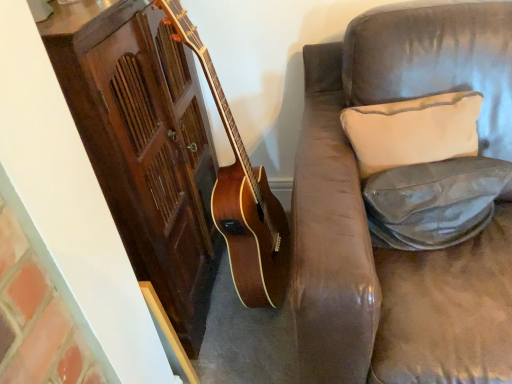
Describe the element at coordinates (435, 201) in the screenshot. I see `leather-like gray pillow at right, the 2th pillow from the top` at that location.

This screenshot has height=384, width=512. I want to click on leather-like gray pillow at right, the 2th pillow from the top, so click(x=435, y=201).

You are a GUI agent. You are given a task and a screenshot of the screen. Output one action in this format:
    pyautogui.click(x=<x>, y=<y>)
    Task: Click on the white fabric pillow at upper right, which appears as the second pillow when ordered from the bottom
    This screenshot has width=512, height=384.
    Given the screenshot: What is the action you would take?
    pyautogui.click(x=413, y=130)

This screenshot has height=384, width=512. What do you see at coordinates (413, 130) in the screenshot?
I see `white fabric pillow at upper right, which appears as the second pillow when ordered from the bottom` at bounding box center [413, 130].

Identify the location of leather-like gray pillow at right, the 2th pillow from the top. (435, 201).

Would you say leather-like gray pillow at right, the 2th pillow from the top, is to the left or to the right of white fabric pillow at upper right, which appears as the second pillow when ordered from the bottom, in the picture?

leather-like gray pillow at right, the 2th pillow from the top, is positioned on white fabric pillow at upper right, which appears as the second pillow when ordered from the bottom,'s right side.

Considering the relative positions of leather-like gray pillow at right, the 2th pillow from the top, and white fabric pillow at upper right, which appears as the second pillow when ordered from the bottom, in the image provided, is leather-like gray pillow at right, the 2th pillow from the top, in front of white fabric pillow at upper right, which appears as the second pillow when ordered from the bottom,?

That is True.

Is point (454, 234) closer or farther from the camera than point (404, 126)?

Point (454, 234) is closer to the camera than point (404, 126).

From the image's perspective, is leather-like gray pillow at right, marked as the 1th pillow in a bottom-to-top arrangement, positioned above or below white fabric pillow at upper right, marked as the first pillow in a top-to-bottom arrangement?

From the image's perspective, leather-like gray pillow at right, marked as the 1th pillow in a bottom-to-top arrangement, appears below white fabric pillow at upper right, marked as the first pillow in a top-to-bottom arrangement.

From a real-world perspective, is leather-like gray pillow at right, the 2th pillow from the top, above or below white fabric pillow at upper right, marked as the first pillow in a top-to-bottom arrangement?

leather-like gray pillow at right, the 2th pillow from the top, is below white fabric pillow at upper right, marked as the first pillow in a top-to-bottom arrangement.

Does leather-like gray pillow at right, marked as the 1th pillow in a bottom-to-top arrangement, have a lesser width compared to white fabric pillow at upper right, marked as the first pillow in a top-to-bottom arrangement?

Correct, the width of leather-like gray pillow at right, marked as the 1th pillow in a bottom-to-top arrangement, is less than that of white fabric pillow at upper right, marked as the first pillow in a top-to-bottom arrangement.

Considering the relative sizes of leather-like gray pillow at right, the 2th pillow from the top, and white fabric pillow at upper right, which appears as the second pillow when ordered from the bottom, in the image provided, is leather-like gray pillow at right, the 2th pillow from the top, taller than white fabric pillow at upper right, which appears as the second pillow when ordered from the bottom,?

No, leather-like gray pillow at right, the 2th pillow from the top, is not taller than white fabric pillow at upper right, which appears as the second pillow when ordered from the bottom.

Can you confirm if leather-like gray pillow at right, the 2th pillow from the top, is bigger than white fabric pillow at upper right, which appears as the second pillow when ordered from the bottom?

No, leather-like gray pillow at right, the 2th pillow from the top, is not bigger than white fabric pillow at upper right, which appears as the second pillow when ordered from the bottom.

Is leather-like gray pillow at right, marked as the 1th pillow in a bottom-to-top arrangement, surrounding white fabric pillow at upper right, marked as the first pillow in a top-to-bottom arrangement?

That's incorrect, white fabric pillow at upper right, marked as the first pillow in a top-to-bottom arrangement, is not inside leather-like gray pillow at right, marked as the 1th pillow in a bottom-to-top arrangement.

Is leather-like gray pillow at right, the 2th pillow from the top, not close to white fabric pillow at upper right, marked as the first pillow in a top-to-bottom arrangement?

They are positioned close to each other.

Is white fabric pillow at upper right, which appears as the second pillow when ordered from the bottom, at the back of leather-like gray pillow at right, the 2th pillow from the top?

Correct, leather-like gray pillow at right, the 2th pillow from the top, is looking away from white fabric pillow at upper right, which appears as the second pillow when ordered from the bottom.

Can you tell me how much leather-like gray pillow at right, marked as the 1th pillow in a bottom-to-top arrangement, and white fabric pillow at upper right, marked as the first pillow in a top-to-bottom arrangement, differ in facing direction?

6.28 degrees.

What are the coordinates of `pillow behind the leather-like gray pillow at right, the 2th pillow from the top` in the screenshot? It's located at (413, 130).

Considering the relative positions of white fabric pillow at upper right, which appears as the second pillow when ordered from the bottom, and leather-like gray pillow at right, marked as the 1th pillow in a bottom-to-top arrangement, in the image provided, is white fabric pillow at upper right, which appears as the second pillow when ordered from the bottom, to the right of leather-like gray pillow at right, marked as the 1th pillow in a bottom-to-top arrangement, from the viewer's perspective?

Incorrect, white fabric pillow at upper right, which appears as the second pillow when ordered from the bottom, is not on the right side of leather-like gray pillow at right, marked as the 1th pillow in a bottom-to-top arrangement.

In the image, is white fabric pillow at upper right, which appears as the second pillow when ordered from the bottom, positioned in front of or behind leather-like gray pillow at right, marked as the 1th pillow in a bottom-to-top arrangement?

white fabric pillow at upper right, which appears as the second pillow when ordered from the bottom, is behind leather-like gray pillow at right, marked as the 1th pillow in a bottom-to-top arrangement.

Is point (361, 130) positioned before point (398, 217)?

No, (361, 130) is further to viewer.

From the image's perspective, is white fabric pillow at upper right, which appears as the second pillow when ordered from the bottom, positioned above or below leather-like gray pillow at right, marked as the 1th pillow in a bottom-to-top arrangement?

Clearly, from the image's perspective, white fabric pillow at upper right, which appears as the second pillow when ordered from the bottom, is above leather-like gray pillow at right, marked as the 1th pillow in a bottom-to-top arrangement.

From a real-world perspective, is white fabric pillow at upper right, marked as the first pillow in a top-to-bottom arrangement, over leather-like gray pillow at right, marked as the 1th pillow in a bottom-to-top arrangement?

Yes.

Between white fabric pillow at upper right, which appears as the second pillow when ordered from the bottom, and leather-like gray pillow at right, marked as the 1th pillow in a bottom-to-top arrangement, which one has smaller width?

Thinner between the two is leather-like gray pillow at right, marked as the 1th pillow in a bottom-to-top arrangement.

Considering the sizes of objects white fabric pillow at upper right, marked as the first pillow in a top-to-bottom arrangement, and leather-like gray pillow at right, marked as the 1th pillow in a bottom-to-top arrangement, in the image provided, who is shorter, white fabric pillow at upper right, marked as the first pillow in a top-to-bottom arrangement, or leather-like gray pillow at right, marked as the 1th pillow in a bottom-to-top arrangement,?

With less height is leather-like gray pillow at right, marked as the 1th pillow in a bottom-to-top arrangement.

Can you confirm if white fabric pillow at upper right, marked as the first pillow in a top-to-bottom arrangement, is bigger than leather-like gray pillow at right, the 2th pillow from the top?

Yes.

Would you say white fabric pillow at upper right, which appears as the second pillow when ordered from the bottom, is inside or outside leather-like gray pillow at right, marked as the 1th pillow in a bottom-to-top arrangement?

white fabric pillow at upper right, which appears as the second pillow when ordered from the bottom, lies outside leather-like gray pillow at right, marked as the 1th pillow in a bottom-to-top arrangement.

Are white fabric pillow at upper right, which appears as the second pillow when ordered from the bottom, and leather-like gray pillow at right, marked as the 1th pillow in a bottom-to-top arrangement, beside each other?

Yes.

Looking at this image, is white fabric pillow at upper right, marked as the first pillow in a top-to-bottom arrangement, facing away from leather-like gray pillow at right, marked as the 1th pillow in a bottom-to-top arrangement?

white fabric pillow at upper right, marked as the first pillow in a top-to-bottom arrangement, does not have its back to leather-like gray pillow at right, marked as the 1th pillow in a bottom-to-top arrangement.

How distant is white fabric pillow at upper right, marked as the first pillow in a top-to-bottom arrangement, from leather-like gray pillow at right, the 2th pillow from the top?

white fabric pillow at upper right, marked as the first pillow in a top-to-bottom arrangement, is 9.99 centimeters from leather-like gray pillow at right, the 2th pillow from the top.

Locate an element on the screen. pillow above the leather-like gray pillow at right, marked as the 1th pillow in a bottom-to-top arrangement (from the image's perspective) is located at coordinates (413, 130).

Where is `pillow that appears in front of the white fabric pillow at upper right, marked as the first pillow in a top-to-bottom arrangement`? pillow that appears in front of the white fabric pillow at upper right, marked as the first pillow in a top-to-bottom arrangement is located at coordinates (435, 201).

Locate an element on the screen. The image size is (512, 384). pillow on the right of the white fabric pillow at upper right, which appears as the second pillow when ordered from the bottom is located at coordinates (435, 201).